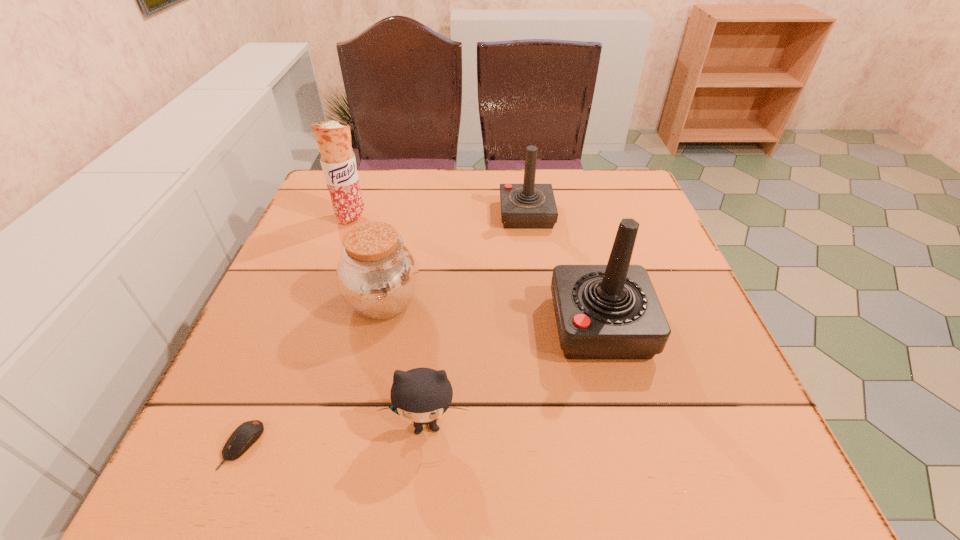
Find the location of a particular element. Image resolution: width=960 pixels, height=540 pixels. vacant space that satisfies the following two spatial constraints: 1. on the front-facing side of the taller joystick; 2. on the front-facing side of the kitten is located at coordinates (626, 424).